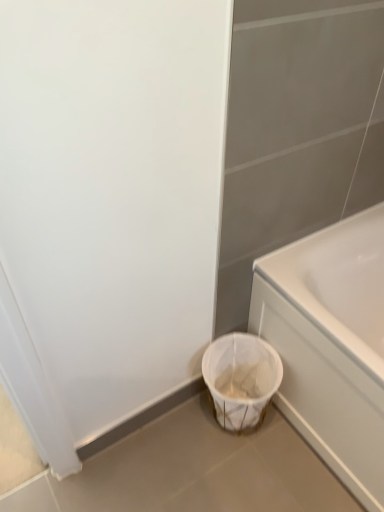
This screenshot has width=384, height=512. Describe the element at coordinates (241, 378) in the screenshot. I see `white woven laundry basket at lower center` at that location.

Locate an element on the screen. This screenshot has height=512, width=384. white woven laundry basket at lower center is located at coordinates (241, 378).

Describe the element at coordinates (331, 344) in the screenshot. This screenshot has height=512, width=384. I see `white glossy bathtub at lower right` at that location.

Image resolution: width=384 pixels, height=512 pixels. Identify the location of white glossy bathtub at lower right. (331, 344).

Where is `white woven laundry basket at lower center`? The height and width of the screenshot is (512, 384). white woven laundry basket at lower center is located at coordinates (241, 378).

In the image, is white glossy bathtub at lower right on the left side or the right side of white woven laundry basket at lower center?

Clearly, white glossy bathtub at lower right is on the right of white woven laundry basket at lower center in the image.

In the image, is white glossy bathtub at lower right positioned in front of or behind white woven laundry basket at lower center?

white glossy bathtub at lower right is in front of white woven laundry basket at lower center.

Which point is more forward, (x=274, y=288) or (x=214, y=384)?

Positioned in front is point (x=274, y=288).

Looking at this image, from the image's perspective, is white glossy bathtub at lower right under white woven laundry basket at lower center?

Actually, white glossy bathtub at lower right appears above white woven laundry basket at lower center in the image.

In the scene shown: From a real-world perspective, which is physically below, white glossy bathtub at lower right or white woven laundry basket at lower center?

From a 3D spatial view, white woven laundry basket at lower center is below.

Is white glossy bathtub at lower right wider or thinner than white woven laundry basket at lower center?

Considering their sizes, white glossy bathtub at lower right looks broader than white woven laundry basket at lower center.

Considering the sizes of objects white glossy bathtub at lower right and white woven laundry basket at lower center in the image provided, who is taller, white glossy bathtub at lower right or white woven laundry basket at lower center?

white glossy bathtub at lower right is taller.

Does white glossy bathtub at lower right have a larger size compared to white woven laundry basket at lower center?

Indeed, white glossy bathtub at lower right has a larger size compared to white woven laundry basket at lower center.

From the picture: Is white glossy bathtub at lower right positioned beyond the bounds of white woven laundry basket at lower center?

white glossy bathtub at lower right is positioned outside white woven laundry basket at lower center.

Is white glossy bathtub at lower right far from white woven laundry basket at lower center?

They are positioned close to each other.

Could you tell me if white glossy bathtub at lower right is facing white woven laundry basket at lower center?

Yes.

How many degrees apart are the facing directions of white glossy bathtub at lower right and white woven laundry basket at lower center?

They differ by 0.426 degrees in their facing directions.

Could you measure the distance between white glossy bathtub at lower right and white woven laundry basket at lower center?

A distance of 8.29 inches exists between white glossy bathtub at lower right and white woven laundry basket at lower center.

Locate an element on the screen. This screenshot has height=512, width=384. laundry basket below the white glossy bathtub at lower right (from a real-world perspective) is located at coordinates (241, 378).

Is white woven laundry basket at lower center at the right side of white glossy bathtub at lower right?

No, white woven laundry basket at lower center is not to the right of white glossy bathtub at lower right.

Which object is closer to the camera taking this photo, white woven laundry basket at lower center or white glossy bathtub at lower right?

white glossy bathtub at lower right is in front.

Does point (239, 351) come in front of point (272, 274)?

No, it is not.

From the image's perspective, which one is positioned lower, white woven laundry basket at lower center or white glossy bathtub at lower right?

white woven laundry basket at lower center.

From a real-world perspective, which is physically above, white woven laundry basket at lower center or white glossy bathtub at lower right?

white glossy bathtub at lower right, from a real-world perspective.

Considering the sizes of objects white woven laundry basket at lower center and white glossy bathtub at lower right in the image provided, who is thinner, white woven laundry basket at lower center or white glossy bathtub at lower right?

With smaller width is white woven laundry basket at lower center.

Does white woven laundry basket at lower center have a lesser height compared to white glossy bathtub at lower right?

Correct, white woven laundry basket at lower center is not as tall as white glossy bathtub at lower right.

Between white woven laundry basket at lower center and white glossy bathtub at lower right, which one has smaller size?

With smaller size is white woven laundry basket at lower center.

Is white woven laundry basket at lower center not within white glossy bathtub at lower right?

Indeed, white woven laundry basket at lower center is completely outside white glossy bathtub at lower right.

Are white woven laundry basket at lower center and white glossy bathtub at lower right beside each other?

white woven laundry basket at lower center is not next to white glossy bathtub at lower right, and they're not touching.

Is white woven laundry basket at lower center facing towards white glossy bathtub at lower right?

No, white woven laundry basket at lower center is not aimed at white glossy bathtub at lower right.

What are the coordinates of `laundry basket behind the white glossy bathtub at lower right` in the screenshot? It's located at (241, 378).

At what (x,y) coordinates should I click in order to perform the action: click on bathtub that is in front of the white woven laundry basket at lower center. Please return your answer as a coordinate pair (x, y). Looking at the image, I should click on (331, 344).

Image resolution: width=384 pixels, height=512 pixels. Find the location of `laundry basket directly beneath the white glossy bathtub at lower right (from a real-world perspective)`. laundry basket directly beneath the white glossy bathtub at lower right (from a real-world perspective) is located at coordinates tap(241, 378).